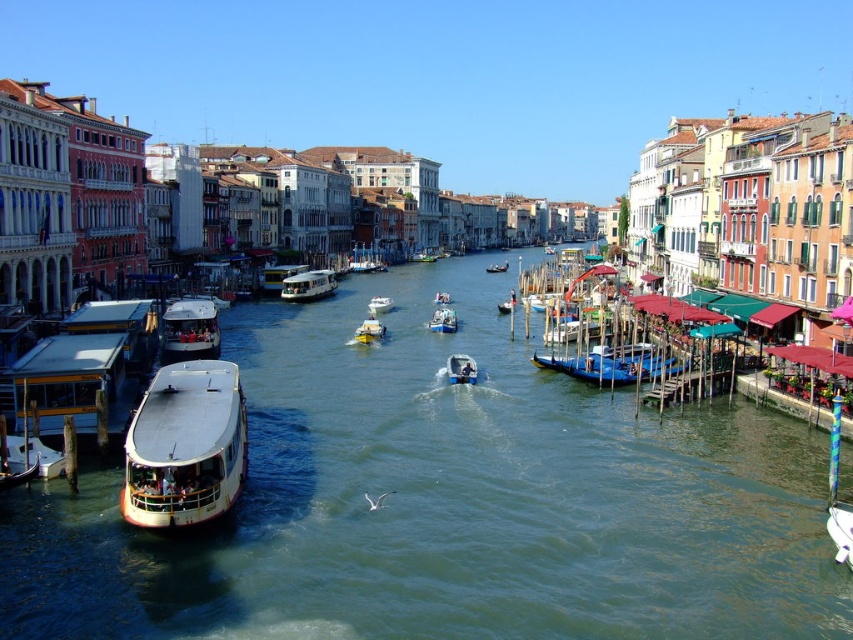
Question: Estimate the real-world distances between objects in this image. Which object is closer to the metallic silver gondola at center?

Choices:
 (A) blue polished gondola at right
 (B) white glossy waterbus at center

Answer: (A)

Question: Which point is closer to the camera taking this photo?

Choices:
 (A) (374, 320)
 (B) (646, 353)

Answer: (B)

Question: Which object appears farthest from the camera in this image?

Choices:
 (A) metallic blue boat at center
 (B) white glossy waterbus at center

Answer: (B)

Question: Does white glossy boat at center-left have a larger size compared to wooden gondola at center?

Choices:
 (A) yes
 (B) no

Answer: (B)

Question: Does metallic silver gondola at center have a smaller size compared to wooden gondola at center?

Choices:
 (A) no
 (B) yes

Answer: (B)

Question: Does metallic gold boat at center have a smaller size compared to metallic blue boat at center?

Choices:
 (A) no
 (B) yes

Answer: (B)